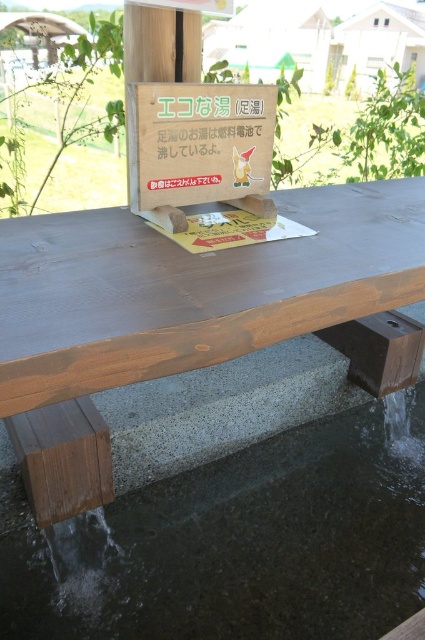
You are a visitor at the foot bath station and want to place a small towel on the stained wood picnic table at center. Can you confirm if the clear concrete water at lower center will reach the table if it rises by 10 cm?

The clear concrete water at lower center has a lesser height compared to the stained wood picnic table at center. If the water rises by 10 cm, it might reach the table depending on the original height difference. However, without knowing the exact original height difference, it is uncertain whether the water will reach the table.

You are standing at the wooden structure and want to place a small decoration. There are two points marked as point (161,554) and point (379,193). Which point is closer to you?

Point (161,554) is in front of point (379,193), so it is closer to you.

You are a person standing at the foot bath station. You want to pour water from the stained wood picnic table at center into a container. Can you reach the clear concrete water at lower center from the picnic table without moving the container?

The clear concrete water at lower center might be wider than the stained wood picnic table at center, so it is possible that the water extends beyond the table. However, since the exact distance isn not specified, you should check the actual width to ensure you can reach it safely.